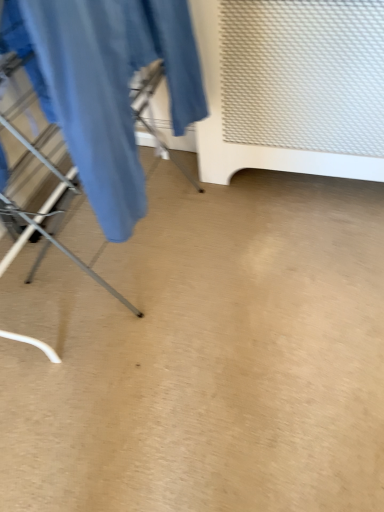
You are a GUI agent. You are given a task and a screenshot of the screen. Output one action in this format:
    pyautogui.click(x=<x>, y=<y>)
    Task: Click on the vacant space in matte blue fabric at left (from a real-world perspective)
    The image size is (384, 512).
    Given the screenshot: What is the action you would take?
    pyautogui.click(x=178, y=248)